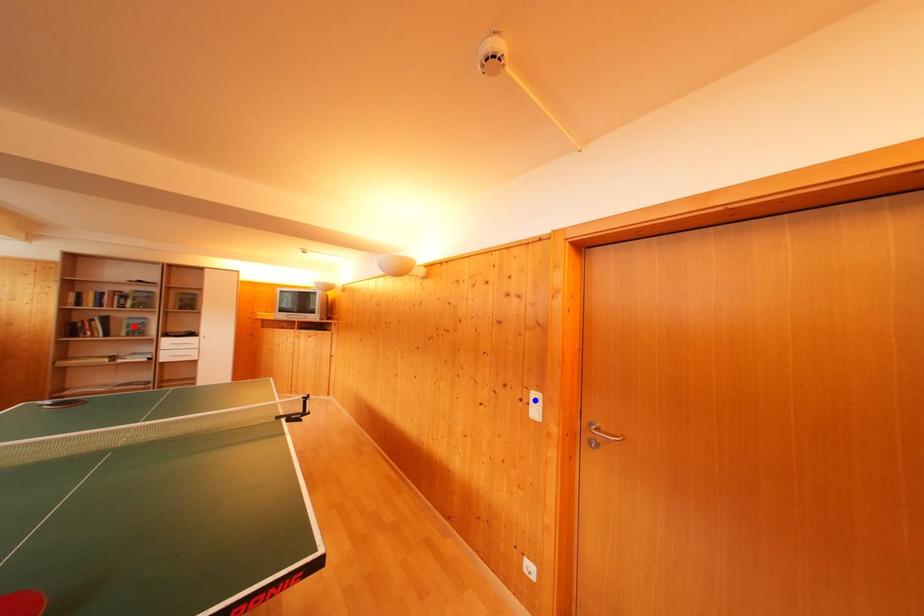
Question: Two points are marked on the image. Which point is closer to the camera?

Choices:
 (A) Blue point is closer.
 (B) Red point is closer.

Answer: (A)